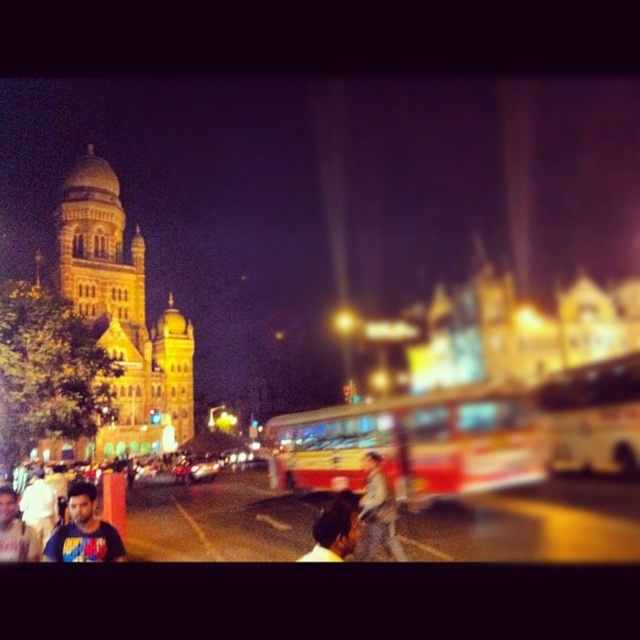
I want to click on yellow painted metal bus at center, so [412, 442].

Does point (506, 472) lie in front of point (3, 516)?

No.

Identify the location of yellow painted metal bus at center. (412, 442).

Between point (536, 396) and point (70, 509), which one is positioned behind?

Positioned behind is point (536, 396).

Does yellow metallic bus at center appear under dark blue t-shirt at center?

No.

Who is more distant from viewer, [625,356] or [106,552]?

Point [625,356]

The width and height of the screenshot is (640, 640). In order to click on yellow metallic bus at center in this screenshot , I will do coord(593,417).

Image resolution: width=640 pixels, height=640 pixels. What do you see at coordinates (124, 317) in the screenshot?
I see `golden stone tower at upper left` at bounding box center [124, 317].

Can you confirm if golden stone tower at upper left is thinner than dark blue t-shirt at center?

No, golden stone tower at upper left is not thinner than dark blue t-shirt at center.

The image size is (640, 640). What are the coordinates of `golden stone tower at upper left` in the screenshot? It's located at (124, 317).

Find the location of a particular element. The height and width of the screenshot is (640, 640). golden stone tower at upper left is located at coordinates (124, 317).